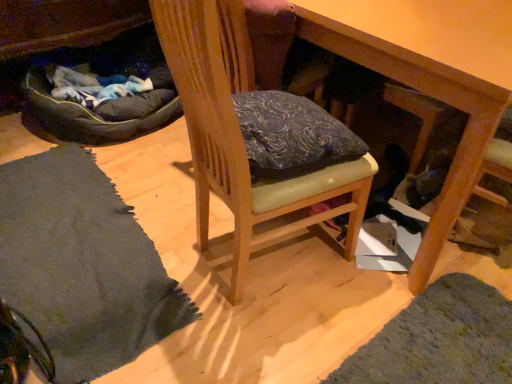
Locate an element on the screen. The height and width of the screenshot is (384, 512). free space below wooden chair at center (from a real-world perspective) is located at coordinates (279, 261).